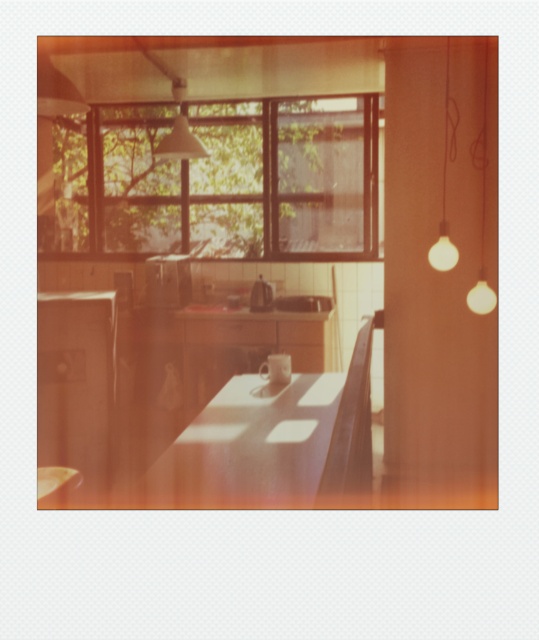
Between point (257, 381) and point (472, 152), which one is positioned behind?

Positioned behind is point (472, 152).

The width and height of the screenshot is (539, 640). I want to click on white glossy table at center, so click(x=250, y=445).

Who is higher up, matte glass bulb at right or matte white lampshade at upper center?

matte white lampshade at upper center is higher up.

Is matte glass bulb at right further to the viewer compared to matte white lampshade at upper center?

No.

Identify the location of matte glass bulb at right. (481, 211).

Between white glossy table at center and matte white lampshade at upper center, which one appears on the left side from the viewer's perspective?

matte white lampshade at upper center is more to the left.

In the scene shown: Which of these two, white glossy table at center or matte white lampshade at upper center, stands taller?

matte white lampshade at upper center

Is point (181, 461) closer to camera compared to point (175, 88)?

Yes, it is.

Locate an element on the screen. The width and height of the screenshot is (539, 640). white glossy table at center is located at coordinates (250, 445).